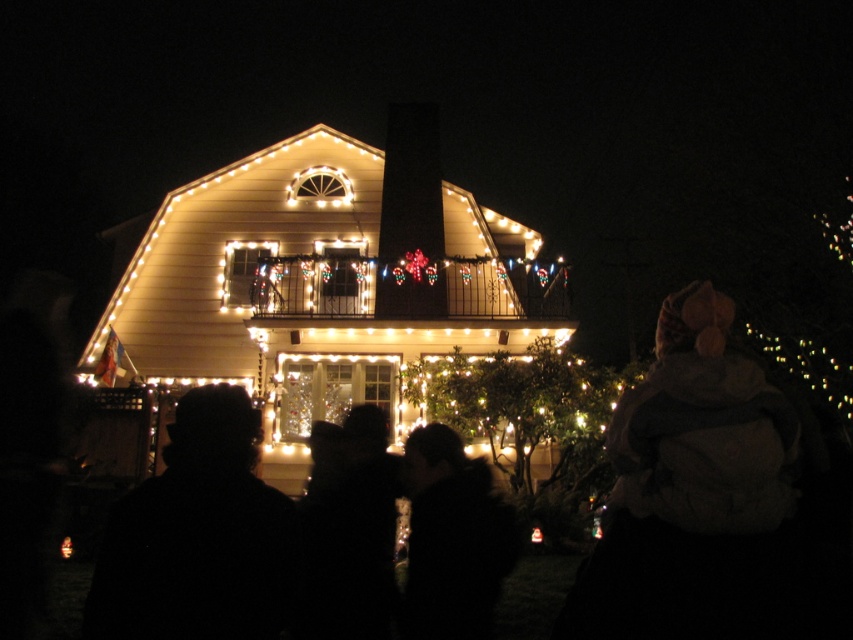
Can you confirm if black fuzzy hat at center is positioned to the right of silhouette of person at center?

In fact, black fuzzy hat at center is to the left of silhouette of person at center.

In the scene shown: Does black fuzzy hat at center appear on the left side of silhouette of person at center?

Indeed, black fuzzy hat at center is positioned on the left side of silhouette of person at center.

The image size is (853, 640). What do you see at coordinates (198, 536) in the screenshot?
I see `black fuzzy hat at center` at bounding box center [198, 536].

This screenshot has height=640, width=853. Find the location of `black fuzzy hat at center`. black fuzzy hat at center is located at coordinates (198, 536).